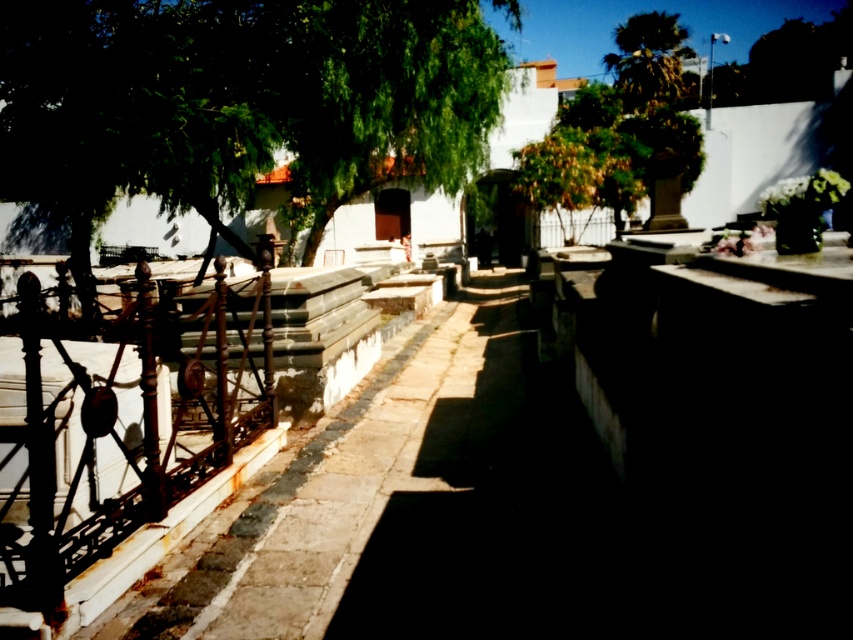
Who is shorter, green leafy tree at upper left or rusty metal rail at left?

With less height is rusty metal rail at left.

This screenshot has width=853, height=640. What do you see at coordinates (238, 102) in the screenshot?
I see `green leafy tree at upper left` at bounding box center [238, 102].

Identify the location of green leafy tree at upper left. (238, 102).

Between point (222, 451) and point (637, 90), which one is positioned in front?

Point (222, 451)

Is rusty metal rail at left in front of green leafy tree at upper right?

Yes, it is in front of green leafy tree at upper right.

Who is more distant from viewer, [271,426] or [645,65]?

The point [645,65] is more distant.

Identify the location of rusty metal rail at left. The height and width of the screenshot is (640, 853). (122, 442).

Can you confirm if green leafy tree at upper left is taller than green leafy tree at upper right?

Incorrect, green leafy tree at upper left's height is not larger of green leafy tree at upper right's.

Looking at this image, who is lower down, green leafy tree at upper left or green leafy tree at upper right?

green leafy tree at upper left is lower down.

Between point (59, 116) and point (641, 92), which one is positioned in front?

Positioned in front is point (59, 116).

This screenshot has height=640, width=853. I want to click on green leafy tree at upper left, so click(x=238, y=102).